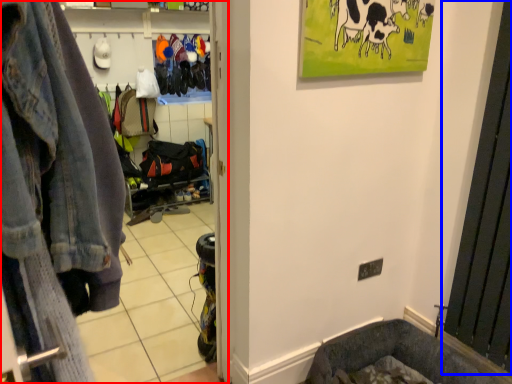
Question: Which object appears closest to the camera in this image, clothing store (highlighted by a red box) or screen door (highlighted by a blue box)?

Choices:
 (A) clothing store
 (B) screen door

Answer: (A)